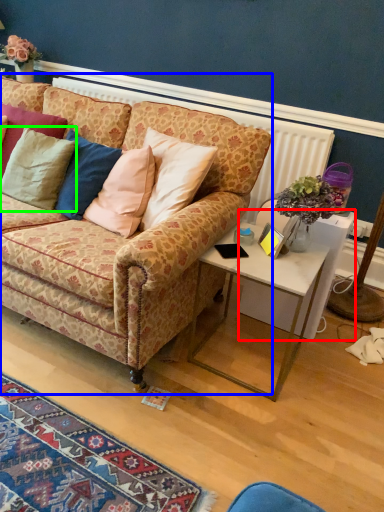
Question: Estimate the real-world distances between objects in this image. Which object is closer to desk (highlighted by a red box), studio couch (highlighted by a blue box) or pillow (highlighted by a green box)?

Choices:
 (A) studio couch
 (B) pillow

Answer: (A)